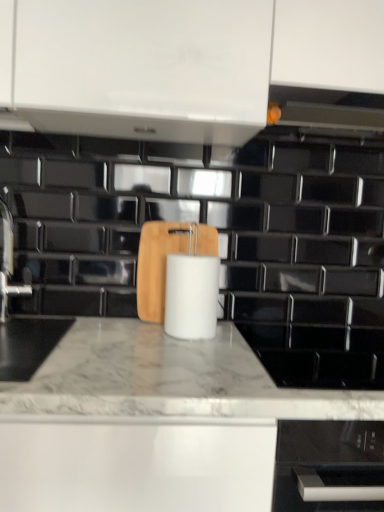
Where is `free region on the left part of white matte paper towel at center`? The width and height of the screenshot is (384, 512). free region on the left part of white matte paper towel at center is located at coordinates (138, 337).